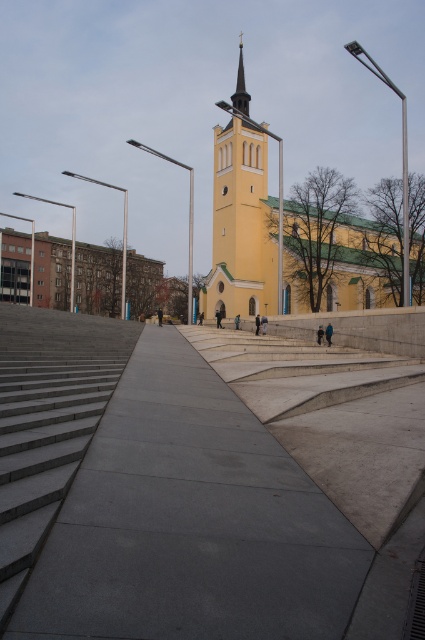
Which is more to the left, gray concrete stairs at center or polished gold spire at center?

gray concrete stairs at center is more to the left.

Identify the location of gray concrete stairs at center. (48, 420).

Which is below, yellow matte church at center or polished gold spire at center?

yellow matte church at center is below.

Which is behind, point (221, 218) or point (243, 109)?

Positioned behind is point (243, 109).

Who is more forward, (263,266) or (248,93)?

Point (263,266)

Image resolution: width=425 pixels, height=640 pixels. I want to click on yellow matte church at center, so click(337, 252).

Which of these two, gray concrete pavement at center or polished gold spire at center, stands taller?

Standing taller between the two is polished gold spire at center.

You are a GUI agent. You are given a task and a screenshot of the screen. Output one action in this format:
    pyautogui.click(x=<x>, y=<y>)
    Task: Click on the gray concrete pavement at center
    The height and width of the screenshot is (640, 425).
    Given the screenshot: What is the action you would take?
    pyautogui.click(x=212, y=483)

Image resolution: width=425 pixels, height=640 pixels. Identify the location of gray concrete pavement at center. (212, 483).